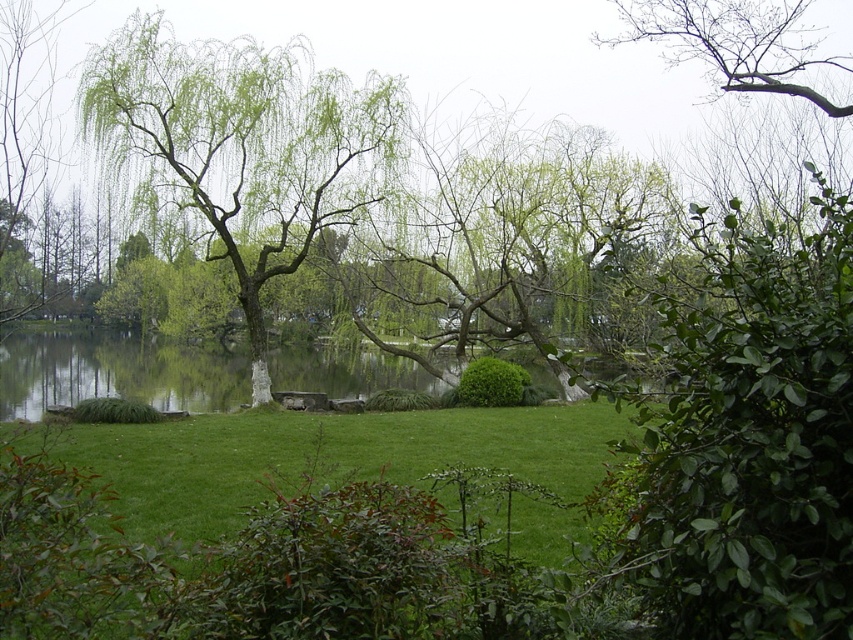
You are a landscape architect designing a new park. You have to decide whether to place a 1.2 meter wide garden path between the green leafy willow at center and the green grassy lake at center. Based on their widths, will there be enough space for the path?

The green leafy willow at center is thinner than the green grassy lake at center. Since the path requires 1.2 meters, but the description only states the willow is thinner, we need more specific width details to confirm. However, assuming the difference in width allows for the path, it might be possible, but the information provided isn not sufficient to guarantee it.